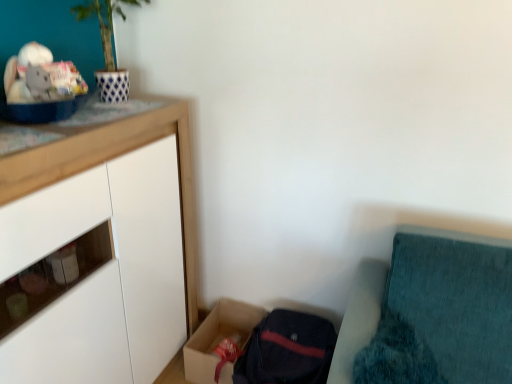
Locate an element on the screen. The image size is (512, 384). teal fabric cushion at lower right is located at coordinates (358, 318).

Image resolution: width=512 pixels, height=384 pixels. What do you see at coordinates (358, 318) in the screenshot?
I see `teal fabric cushion at lower right` at bounding box center [358, 318].

In order to click on cardboard box at lower center in this screenshot , I will do `click(218, 336)`.

Considering the sizes of objects white matte cabinet at upper left and teal fabric cushion at lower right in the image provided, who is wider, white matte cabinet at upper left or teal fabric cushion at lower right?

Wider between the two is white matte cabinet at upper left.

Considering the relative sizes of white matte cabinet at upper left and teal fabric cushion at lower right in the image provided, is white matte cabinet at upper left taller than teal fabric cushion at lower right?

Yes, white matte cabinet at upper left is taller than teal fabric cushion at lower right.

The width and height of the screenshot is (512, 384). Identify the location of furniture on the right of white matte cabinet at upper left. (358, 318).

In the scene shown: Is white matte cabinet at upper left positioned beyond the bounds of teal fabric cushion at lower right?

white matte cabinet at upper left is positioned outside teal fabric cushion at lower right.

From the picture: Which object is wider, cardboard box at lower center or white matte cabinet at upper left?

white matte cabinet at upper left is wider.

Would you say cardboard box at lower center is to the left or to the right of white matte cabinet at upper left in the picture?

Based on their positions, cardboard box at lower center is located to the right of white matte cabinet at upper left.

At what (x,y) coordinates should I click in order to perform the action: click on cabinetry above the cardboard box at lower center (from a real-world perspective). Please return your answer as a coordinate pair (x, y). Looking at the image, I should click on (99, 251).

Is the depth of cardboard box at lower center greater than that of white matte cabinet at upper left?

Yes, cardboard box at lower center is further from the camera.

Which is more to the right, teal fabric cushion at lower right or cardboard box at lower center?

From the viewer's perspective, teal fabric cushion at lower right appears more on the right side.

Is teal fabric cushion at lower right thinner than cardboard box at lower center?

Correct, the width of teal fabric cushion at lower right is less than that of cardboard box at lower center.

Is teal fabric cushion at lower right not inside cardboard box at lower center?

teal fabric cushion at lower right lies outside cardboard box at lower center's area.

You are a GUI agent. You are given a task and a screenshot of the screen. Output one action in this format:
    pyautogui.click(x=<x>, y=<y>)
    Task: Click on the storage box below the teal fabric cushion at lower right (from the image's perspective)
    
    Given the screenshot: What is the action you would take?
    pyautogui.click(x=218, y=336)

Does cardboard box at lower center have a smaller size compared to teal fabric cushion at lower right?

Correct, cardboard box at lower center occupies less space than teal fabric cushion at lower right.

You are a GUI agent. You are given a task and a screenshot of the screen. Output one action in this format:
    pyautogui.click(x=<x>, y=<y>)
    Task: Click on the storage box located on the left of teal fabric cushion at lower right
    
    Given the screenshot: What is the action you would take?
    pyautogui.click(x=218, y=336)

Looking at this image, which object is closer to the camera, cardboard box at lower center or teal fabric cushion at lower right?

Positioned in front is teal fabric cushion at lower right.

Which object is positioned more to the left, white matte cabinet at upper left or cardboard box at lower center?

white matte cabinet at upper left.

Is cardboard box at lower center a part of white matte cabinet at upper left?

No, cardboard box at lower center is located outside of white matte cabinet at upper left.

Is white matte cabinet at upper left looking in the opposite direction of cardboard box at lower center?

No, white matte cabinet at upper left's orientation is not away from cardboard box at lower center.

In terms of width, does teal fabric cushion at lower right look wider or thinner when compared to white matte cabinet at upper left?

teal fabric cushion at lower right is thinner than white matte cabinet at upper left.

From a real-world perspective, is teal fabric cushion at lower right physically below white matte cabinet at upper left?

Yes, from a real-world perspective, teal fabric cushion at lower right is under white matte cabinet at upper left.

From the image's perspective, who appears lower, teal fabric cushion at lower right or white matte cabinet at upper left?

teal fabric cushion at lower right.

Is teal fabric cushion at lower right smaller than white matte cabinet at upper left?

Correct, teal fabric cushion at lower right occupies less space than white matte cabinet at upper left.

The width and height of the screenshot is (512, 384). In order to click on furniture in front of the white matte cabinet at upper left in this screenshot , I will do `click(358, 318)`.

Where is `storage box below the white matte cabinet at upper left (from a real-world perspective)`? The image size is (512, 384). storage box below the white matte cabinet at upper left (from a real-world perspective) is located at coordinates (218, 336).

Based on their spatial positions, is white matte cabinet at upper left or cardboard box at lower center further from teal fabric cushion at lower right?

Among the two, white matte cabinet at upper left is located further to teal fabric cushion at lower right.

From the image, which object appears to be farther from cardboard box at lower center, white matte cabinet at upper left or teal fabric cushion at lower right?

teal fabric cushion at lower right is further to cardboard box at lower center.

Based on their spatial positions, is teal fabric cushion at lower right or white matte cabinet at upper left further from cardboard box at lower center?

teal fabric cushion at lower right is positioned further to the anchor cardboard box at lower center.

Which object lies further to the anchor point white matte cabinet at upper left, teal fabric cushion at lower right or cardboard box at lower center?

teal fabric cushion at lower right is further to white matte cabinet at upper left.

Based on their spatial positions, is cardboard box at lower center or teal fabric cushion at lower right further from white matte cabinet at upper left?

teal fabric cushion at lower right is further to white matte cabinet at upper left.

Estimate the real-world distances between objects in this image. Which object is closer to teal fabric cushion at lower right, cardboard box at lower center or white matte cabinet at upper left?

Based on the image, cardboard box at lower center appears to be nearer to teal fabric cushion at lower right.

Locate an element on the screen. The image size is (512, 384). cabinetry between teal fabric cushion at lower right and cardboard box at lower center along the z-axis is located at coordinates (99, 251).